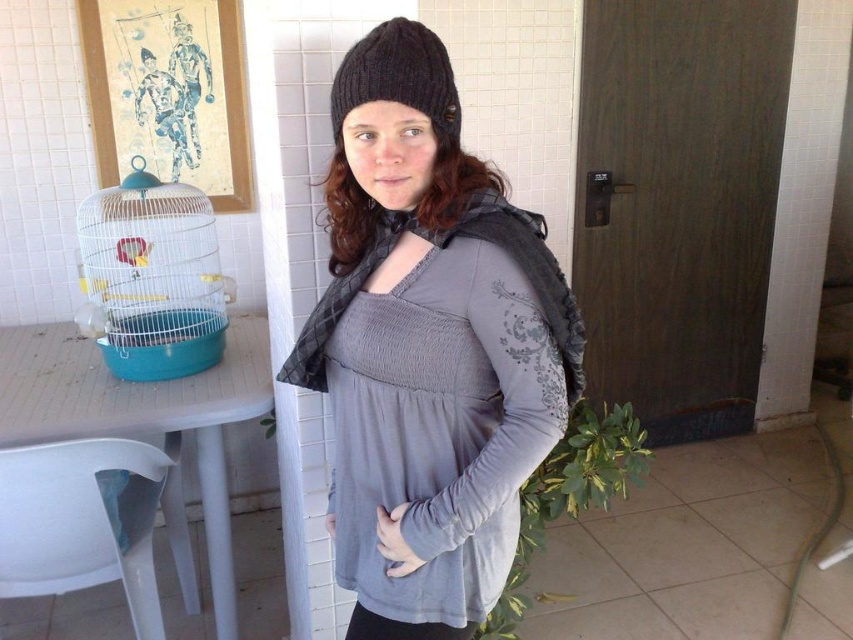
Question: Can you confirm if blue wire birdcage at left is bigger than black knitted beanie at upper center?

Choices:
 (A) no
 (B) yes

Answer: (B)

Question: Which object appears farthest from the camera in this image?

Choices:
 (A) knitted dark gray beanie at center
 (B) white plastic chair at lower left
 (C) black knitted beanie at upper center

Answer: (B)

Question: Observing the image, what is the correct spatial positioning of knitted dark gray beanie at center in reference to white plastic chair at lower left?

Choices:
 (A) right
 (B) left

Answer: (A)

Question: Can you confirm if knitted dark gray beanie at center is positioned to the right of blue wire birdcage at left?

Choices:
 (A) yes
 (B) no

Answer: (A)

Question: Which of these objects is positioned closest to the knitted dark gray beanie at center?

Choices:
 (A) white plastic chair at lower left
 (B) black knitted beanie at upper center
 (C) blue wire birdcage at left

Answer: (B)

Question: Which object is closer to the camera taking this photo?

Choices:
 (A) blue wire birdcage at left
 (B) knitted dark gray beanie at center

Answer: (B)